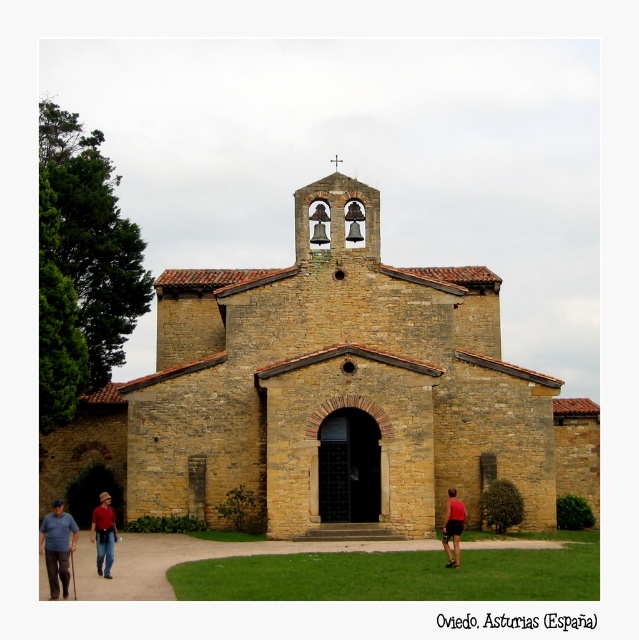
Measure the distance between yellow stone chapel at center and blue shirt at lower left.

yellow stone chapel at center is 18.80 meters from blue shirt at lower left.

I want to click on yellow stone chapel at center, so click(334, 388).

Where is `yellow stone chapel at center`? yellow stone chapel at center is located at coordinates (334, 388).

Is blue shirt at lower left closer to camera compared to red shirt at lower left?

Yes, blue shirt at lower left is in front of red shirt at lower left.

Identify the location of blue shirt at lower left. The width and height of the screenshot is (639, 640). (58, 547).

From the picture: Does red shirt at lower left appear on the right side of red fabric shorts at lower right?

No, red shirt at lower left is not to the right of red fabric shorts at lower right.

In the scene shown: Is red shirt at lower left positioned before red fabric shorts at lower right?

Yes, it is in front of red fabric shorts at lower right.

Is point (109, 545) closer to camera compared to point (458, 525)?

Yes, it is.

At what (x,y) coordinates should I click in order to perform the action: click on red shirt at lower left. Please return your answer as a coordinate pair (x, y). Image resolution: width=639 pixels, height=640 pixels. Looking at the image, I should click on (104, 534).